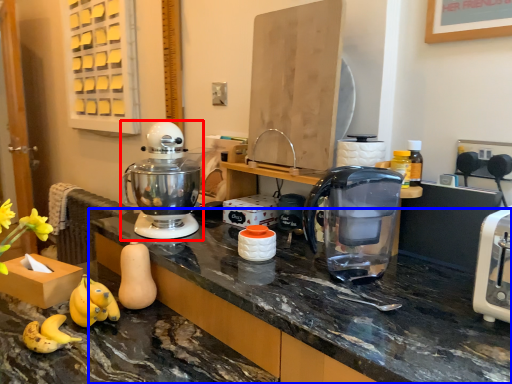
Question: Which of the following is the farthest to the observer, mixer (highlighted by a red box) or countertop (highlighted by a blue box)?

Choices:
 (A) mixer
 (B) countertop

Answer: (A)